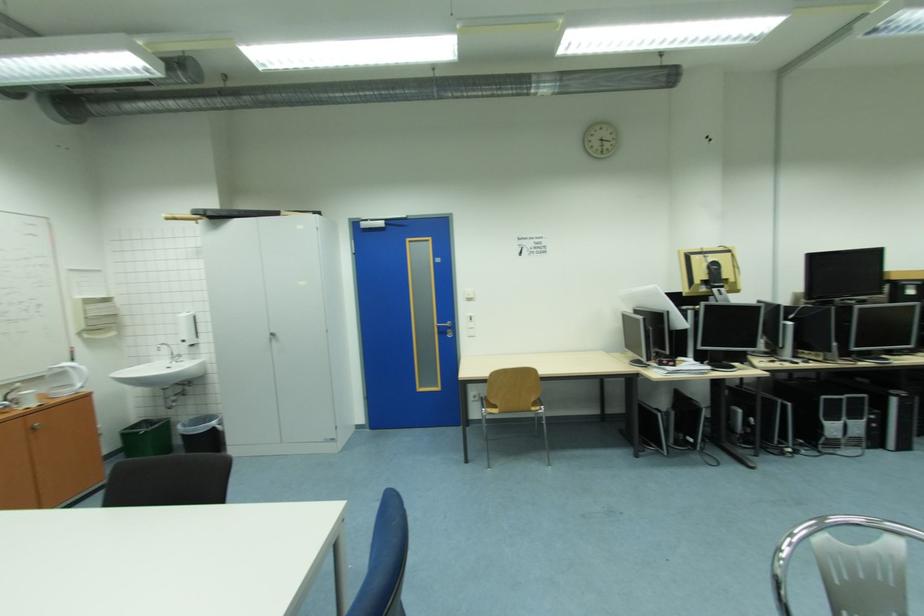
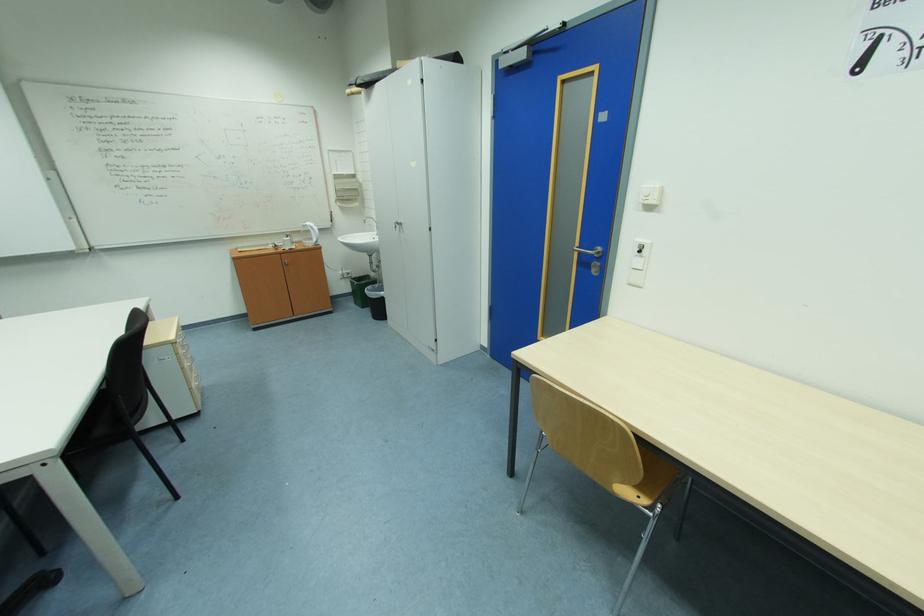
Where in the second image is the point corresponding to the point at 450,334 from the first image?

(590, 264)